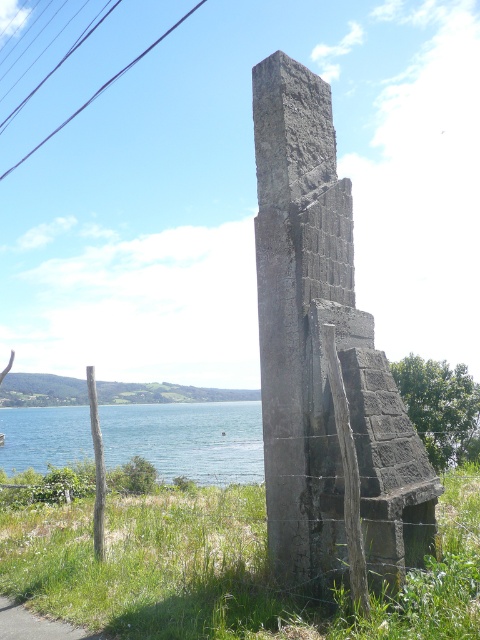
Question: Which point is closer to the camera?

Choices:
 (A) (240, 404)
 (B) (279, 180)

Answer: (B)

Question: Is gray stone monument at center bigger than blue water at lower left?

Choices:
 (A) no
 (B) yes

Answer: (A)

Question: Where is gray stone monument at center located in relation to blue water at lower left in the image?

Choices:
 (A) above
 (B) below

Answer: (A)

Question: In this image, where is gray stone monument at center located relative to blue water at lower left?

Choices:
 (A) above
 (B) below

Answer: (A)

Question: Which object is farther from the camera taking this photo?

Choices:
 (A) blue water at lower left
 (B) gray stone monument at center

Answer: (A)